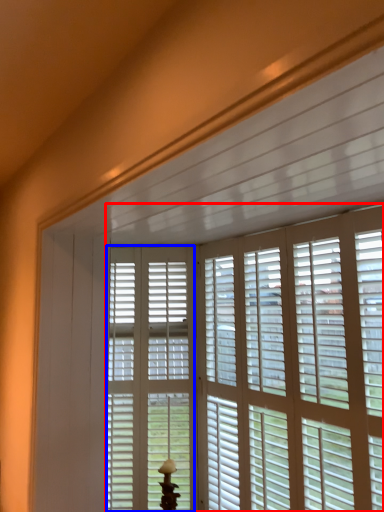
Question: Among these objects, which one is farthest to the camera, window blind (highlighted by a red box) or screen door (highlighted by a blue box)?

Choices:
 (A) window blind
 (B) screen door

Answer: (B)